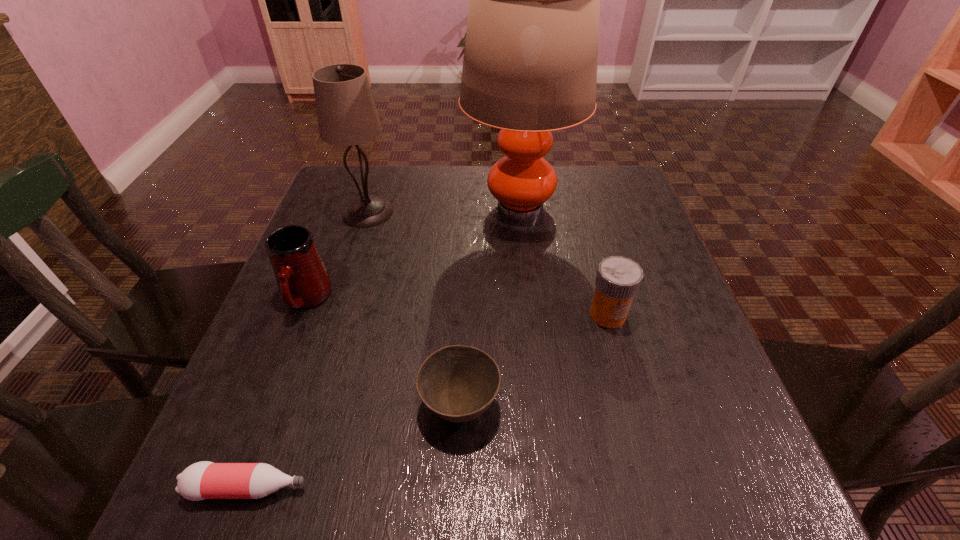
The image size is (960, 540). Find the location of `empty space between the mug and the tallest object`. empty space between the mug and the tallest object is located at coordinates (413, 253).

You are a GUI agent. You are given a task and a screenshot of the screen. Output one action in this format:
    pyautogui.click(x=<x>, y=<y>)
    Task: Click on the free area in between the third tallest object and the second nearest object
    
    Given the screenshot: What is the action you would take?
    pyautogui.click(x=383, y=353)

The image size is (960, 540). I want to click on vacant space in between the third tallest object and the lampshade, so click(x=337, y=255).

Where is `free spot between the mug and the fifth shortest object`? The height and width of the screenshot is (540, 960). free spot between the mug and the fifth shortest object is located at coordinates (337, 255).

The image size is (960, 540). What are the coordinates of `vacant space in between the fourth tallest object and the tallest object` in the screenshot? It's located at (564, 261).

Where is `free area in between the fifth tallest object and the lamp`? This screenshot has height=540, width=960. free area in between the fifth tallest object and the lamp is located at coordinates (490, 306).

In order to click on free space between the medicine and the fourth shortest object in this screenshot , I will do `click(457, 307)`.

Image resolution: width=960 pixels, height=540 pixels. Find the location of `vacant region between the second tallest object and the third tallest object`. vacant region between the second tallest object and the third tallest object is located at coordinates (337, 255).

At what (x,y) coordinates should I click in order to perform the action: click on free area in between the mug and the medicine. Please return your answer as a coordinate pair (x, y). Looking at the image, I should click on (457, 307).

You are a GUI agent. You are given a task and a screenshot of the screen. Output one action in this format:
    pyautogui.click(x=<x>, y=<y>)
    Task: Click on the vacant area that lies between the third shortest object and the lamp
    The image size is (960, 540).
    Given the screenshot: What is the action you would take?
    pyautogui.click(x=564, y=261)